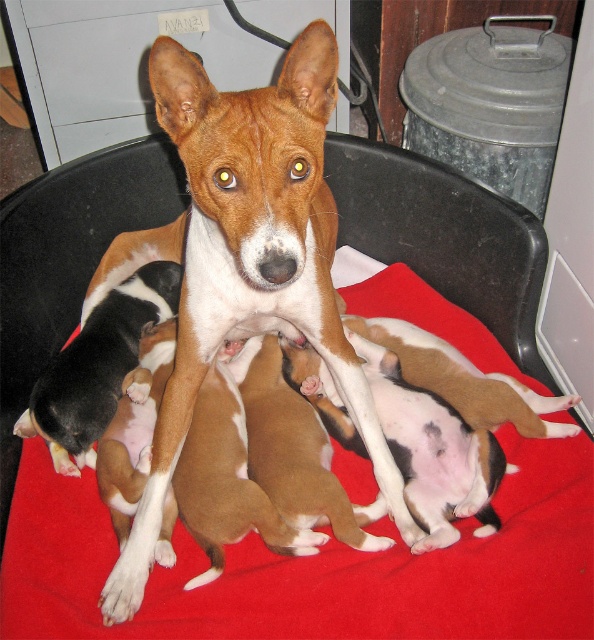
Question: Which of the following is the farthest from the observer?

Choices:
 (A) (503, 20)
 (B) (122, 564)

Answer: (A)

Question: Is red fabric blanket at center smaller than black and white fur at center?

Choices:
 (A) no
 (B) yes

Answer: (A)

Question: Does galvanized metal trash can at upper right have a greater width compared to black and white fur at center?

Choices:
 (A) no
 (B) yes

Answer: (B)

Question: Does red fabric blanket at center appear over black and white fur at center?

Choices:
 (A) no
 (B) yes

Answer: (A)

Question: Based on their relative distances, which object is farther from the brown and white fur at center?

Choices:
 (A) galvanized metal trash can at upper right
 (B) black and white fur at center

Answer: (A)

Question: Which object is positioned farthest from the black and white fur at center?

Choices:
 (A) red fabric blanket at center
 (B) brown and white fur at center

Answer: (B)